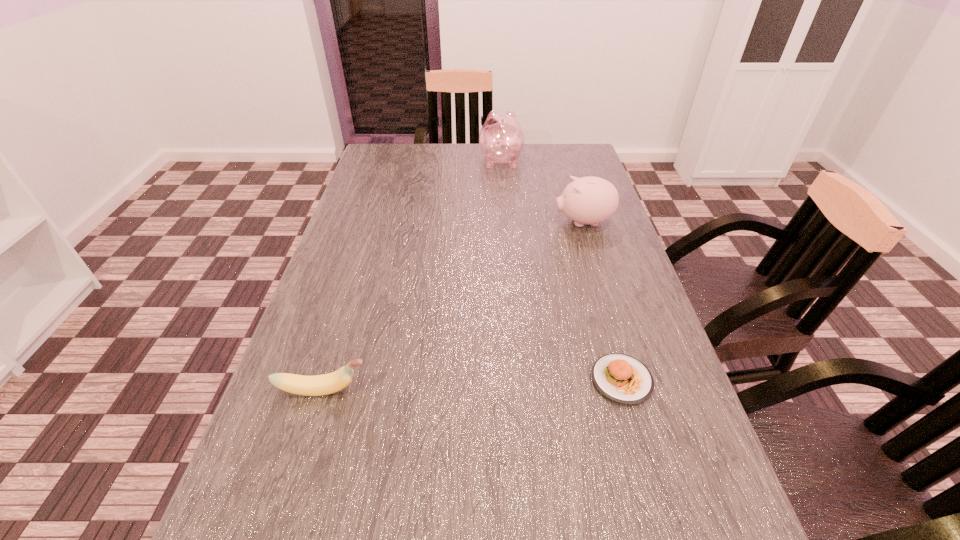
What are the coordinates of `object that stands as the closest to the shorter piggy bank` in the screenshot? It's located at (501, 139).

In order to click on object that is the closest one to the food in this screenshot , I will do `click(590, 200)`.

The image size is (960, 540). Identify the location of free spot that satisfies the following two spatial constraints: 1. on the front side of the shortest object; 2. at the stem of the banana. (625, 390).

The height and width of the screenshot is (540, 960). I want to click on free point that satisfies the following two spatial constraints: 1. on the front side of the food; 2. at the stem of the second shortest object, so click(625, 390).